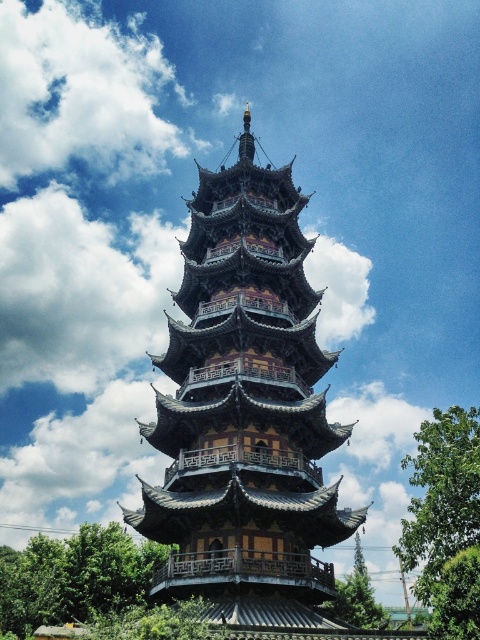
You are standing at the lower left corner of the image and want to walk towards the wooden pagoda at center. Is the green leafy tree at lower left blocking your path to the pagoda?

The wooden pagoda at center is positioned over green leafy tree at lower left, so the tree is behind the pagoda from your perspective. Therefore, the green leafy tree at lower left is not blocking your path to the pagoda.

You are standing in a garden and see the wooden pagoda at center and the green leafy tree at lower left. Which object is located to the left of the other?

The green leafy tree at lower left is located to the left of the wooden pagoda at center.

You are a landscape architect planning to add a new pathway between the green leafy tree at lower left and the green leafy tree at center. Which tree has a wider trunk to ensure the pathway is wide enough to accommodate visitors comfortably?

The green leafy tree at lower left has a wider trunk than the green leafy tree at center, so the pathway should be designed to accommodate its width.